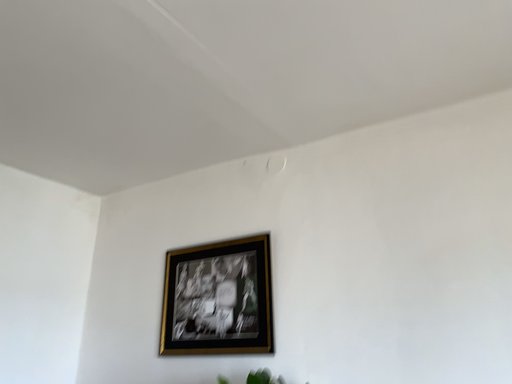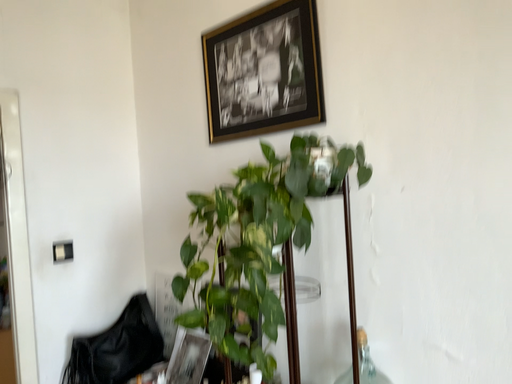
Question: Which way did the camera rotate in the video?

Choices:
 (A) rotated downward
 (B) rotated upward

Answer: (A)